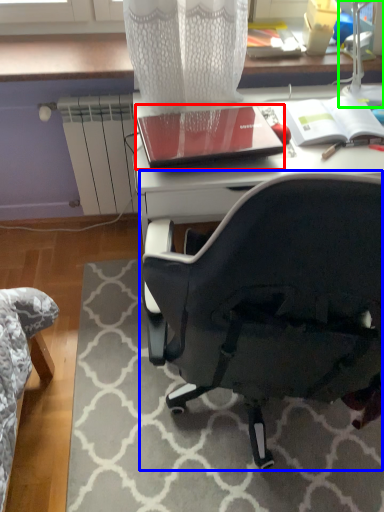
Question: Which object is the farthest from notebook (highlighted by a red box)? Choose among these: chair (highlighted by a blue box) or table lamp (highlighted by a green box).

Choices:
 (A) chair
 (B) table lamp

Answer: (A)